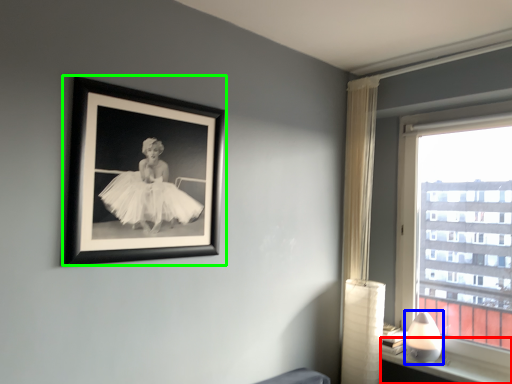
Question: Based on their relative distances, which object is nearer to window sill (highlighted by a red box)? Choose from table lamp (highlighted by a blue box) and picture frame (highlighted by a green box).

Choices:
 (A) table lamp
 (B) picture frame

Answer: (A)